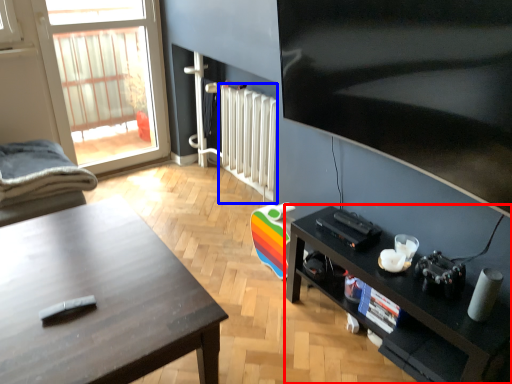
Question: Which object appears farthest to the camera in this image, shelf (highlighted by a red box) or radiator (highlighted by a blue box)?

Choices:
 (A) shelf
 (B) radiator

Answer: (B)